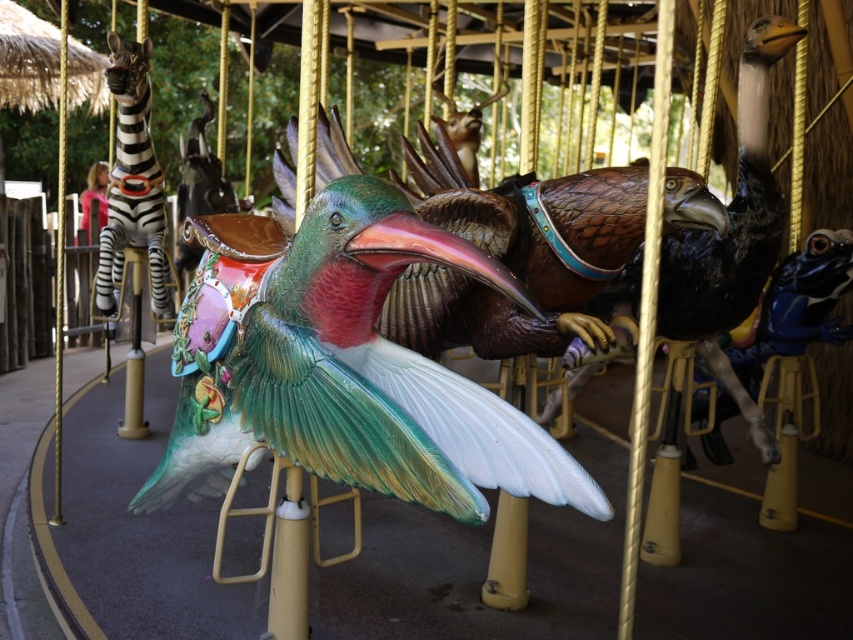
You are at a carnival and want to take a photo of both the shiny green and white bird at center and the shiny metallic zebra at left. Which one should you stand closer to in order to capture both in the same frame?

You should stand closer to the shiny metallic zebra at left because the shiny green and white bird at center is positioned on the right side of it, so positioning yourself near the zebra will allow both to be included in the frame.

You are standing at the entrance of the carousel and want to locate the shiny green and white bird at center. According to the coordinates given, where exactly is it positioned?

The shiny green and white bird at center is positioned at coordinates point (347, 372).

You are a parent trying to decide which ride to choose for your child. You see the shiny green and white bird at center and the shiny brown feathers at center. Which one is positioned higher up in the image?

The shiny brown feathers at center are positioned higher up in the image than the shiny green and white bird at center.